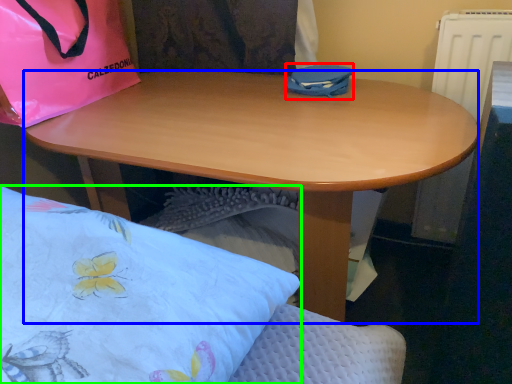
Question: Based on their relative distances, which object is nearer to bag (highlighted by a red box)? Choose from desk (highlighted by a blue box) and pillow (highlighted by a green box).

Choices:
 (A) desk
 (B) pillow

Answer: (A)